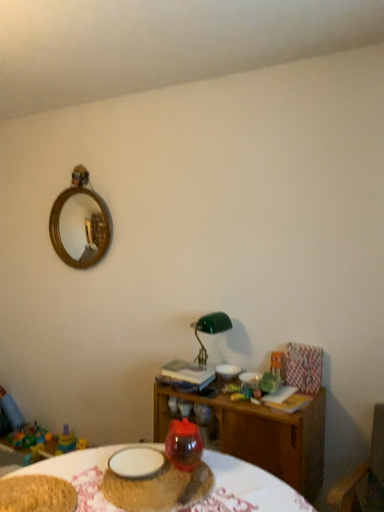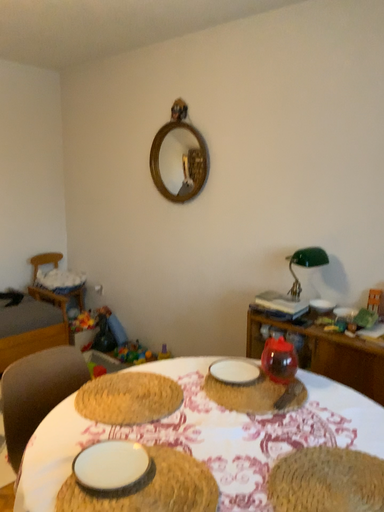
Question: Which way did the camera rotate in the video?

Choices:
 (A) rotated upward
 (B) rotated downward

Answer: (B)